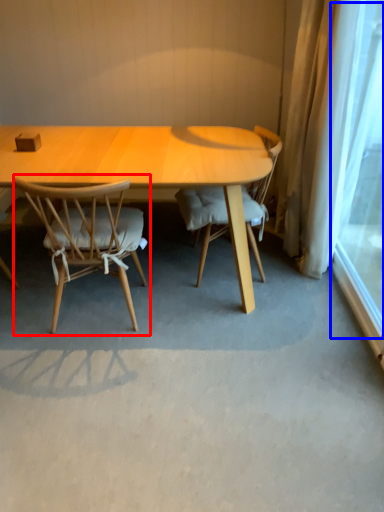
Question: Which of the following is the closest to the observer, chair (highlighted by a red box) or window screen (highlighted by a blue box)?

Choices:
 (A) chair
 (B) window screen

Answer: (B)